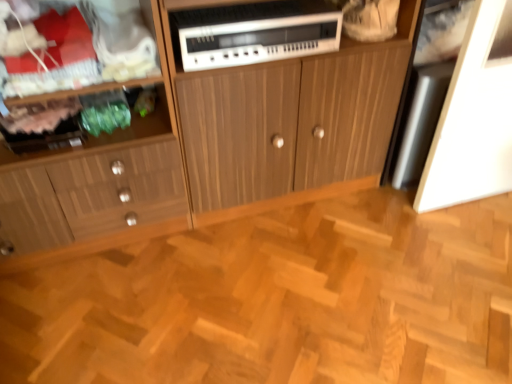
What do you see at coordinates (256, 33) in the screenshot? The height and width of the screenshot is (384, 512). I see `white plastic stereo at center` at bounding box center [256, 33].

I want to click on wooden cabinet at left, placed as the second cabinetry when sorted from right to left, so click(96, 185).

Image resolution: width=512 pixels, height=384 pixels. What do you see at coordinates (96, 185) in the screenshot?
I see `wooden cabinet at left, placed as the second cabinetry when sorted from right to left` at bounding box center [96, 185].

Locate an element on the screen. Image resolution: width=512 pixels, height=384 pixels. white plastic stereo at center is located at coordinates (256, 33).

Looking at their sizes, would you say natural wood parquet floor at center is wider or thinner than white plastic stereo at center?

natural wood parquet floor at center is wider than white plastic stereo at center.

Would you say white plastic stereo at center is part of natural wood parquet floor at center's contents?

No, white plastic stereo at center is located outside of natural wood parquet floor at center.

Considering the positions of point (313, 213) and point (217, 51), is point (313, 213) closer or farther from the camera than point (217, 51)?

Point (313, 213) appears to be farther away from the viewer than point (217, 51).

In the image, is natural wood parquet floor at center positioned in front of or behind white plastic stereo at center?

natural wood parquet floor at center is in front of white plastic stereo at center.

Between wooden cabinet at left, which appears as the first cabinetry when viewed from the left, and wooden cabinet at center, acting as the 1th cabinetry starting from the right, which one is positioned behind?

wooden cabinet at center, acting as the 1th cabinetry starting from the right.

Consider the image. Measure the distance between wooden cabinet at left, placed as the second cabinetry when sorted from right to left, and wooden cabinet at center, which appears as the second cabinetry when viewed from the left.

wooden cabinet at left, placed as the second cabinetry when sorted from right to left, and wooden cabinet at center, which appears as the second cabinetry when viewed from the left, are 15.88 inches apart from each other.

Which of these two, wooden cabinet at left, placed as the second cabinetry when sorted from right to left, or wooden cabinet at center, which appears as the second cabinetry when viewed from the left, is smaller?

Smaller between the two is wooden cabinet at left, placed as the second cabinetry when sorted from right to left.

From the image's perspective, who appears lower, wooden cabinet at left, placed as the second cabinetry when sorted from right to left, or wooden cabinet at center, which appears as the second cabinetry when viewed from the left?

wooden cabinet at left, placed as the second cabinetry when sorted from right to left.

Looking at this image, between wooden cabinet at center, acting as the 1th cabinetry starting from the right, and natural wood parquet floor at center, which one has larger width?

natural wood parquet floor at center is wider.

Is wooden cabinet at center, acting as the 1th cabinetry starting from the right, not near natural wood parquet floor at center?

wooden cabinet at center, acting as the 1th cabinetry starting from the right, is near natural wood parquet floor at center, not far away.

Measure the distance between wooden cabinet at center, acting as the 1th cabinetry starting from the right, and natural wood parquet floor at center.

They are 20.19 inches apart.

Is wooden cabinet at center, which appears as the second cabinetry when viewed from the left, inside or outside of natural wood parquet floor at center?

wooden cabinet at center, which appears as the second cabinetry when viewed from the left, cannot be found inside natural wood parquet floor at center.

Considering the relative positions of wooden cabinet at center, acting as the 1th cabinetry starting from the right, and wooden cabinet at left, which appears as the first cabinetry when viewed from the left, in the image provided, is wooden cabinet at center, acting as the 1th cabinetry starting from the right, behind wooden cabinet at left, which appears as the first cabinetry when viewed from the left,?

That is True.

Between wooden cabinet at center, acting as the 1th cabinetry starting from the right, and wooden cabinet at left, placed as the second cabinetry when sorted from right to left, which one has larger size?

wooden cabinet at center, acting as the 1th cabinetry starting from the right.

From the image's perspective, is wooden cabinet at center, which appears as the second cabinetry when viewed from the left, below wooden cabinet at left, which appears as the first cabinetry when viewed from the left?

Incorrect, from the image's perspective, wooden cabinet at center, which appears as the second cabinetry when viewed from the left, is higher than wooden cabinet at left, which appears as the first cabinetry when viewed from the left.

Which object is wider, wooden cabinet at center, acting as the 1th cabinetry starting from the right, or wooden cabinet at left, placed as the second cabinetry when sorted from right to left?

wooden cabinet at center, acting as the 1th cabinetry starting from the right.

Is white plastic stereo at center wider or thinner than wooden cabinet at center, which appears as the second cabinetry when viewed from the left?

Clearly, white plastic stereo at center has less width compared to wooden cabinet at center, which appears as the second cabinetry when viewed from the left.

Considering the relative sizes of white plastic stereo at center and wooden cabinet at center, acting as the 1th cabinetry starting from the right, in the image provided, is white plastic stereo at center smaller than wooden cabinet at center, acting as the 1th cabinetry starting from the right,?

Correct, white plastic stereo at center occupies less space than wooden cabinet at center, acting as the 1th cabinetry starting from the right.

Is white plastic stereo at center facing towards wooden cabinet at center, which appears as the second cabinetry when viewed from the left?

Yes, white plastic stereo at center is turned towards wooden cabinet at center, which appears as the second cabinetry when viewed from the left.

Is white plastic stereo at center further to camera compared to wooden cabinet at center, which appears as the second cabinetry when viewed from the left?

Yes, the depth of white plastic stereo at center is greater than that of wooden cabinet at center, which appears as the second cabinetry when viewed from the left.

The height and width of the screenshot is (384, 512). Find the location of `home appliance behind the wooden cabinet at left, which appears as the first cabinetry when viewed from the left`. home appliance behind the wooden cabinet at left, which appears as the first cabinetry when viewed from the left is located at coordinates (256, 33).

Does white plastic stereo at center have a larger size compared to wooden cabinet at left, placed as the second cabinetry when sorted from right to left?

No.

Considering the relative sizes of white plastic stereo at center and wooden cabinet at left, placed as the second cabinetry when sorted from right to left, in the image provided, is white plastic stereo at center taller than wooden cabinet at left, placed as the second cabinetry when sorted from right to left,?

No, white plastic stereo at center is not taller than wooden cabinet at left, placed as the second cabinetry when sorted from right to left.

Between white plastic stereo at center and wooden cabinet at left, which appears as the first cabinetry when viewed from the left, which one appears on the left side from the viewer's perspective?

wooden cabinet at left, which appears as the first cabinetry when viewed from the left.

Visually, is natural wood parquet floor at center positioned to the left or to the right of wooden cabinet at center, acting as the 1th cabinetry starting from the right?

Clearly, natural wood parquet floor at center is on the right of wooden cabinet at center, acting as the 1th cabinetry starting from the right, in the image.

From a real-world perspective, who is located higher, natural wood parquet floor at center or wooden cabinet at center, acting as the 1th cabinetry starting from the right?

wooden cabinet at center, acting as the 1th cabinetry starting from the right, is physically above.

Is point (282, 278) positioned in front of point (275, 191)?

Yes, it is.

Identify the location of hardwood located in front of the white plastic stereo at center. (278, 301).

Locate an element on the screen. Image resolution: width=512 pixels, height=384 pixels. cabinetry below the wooden cabinet at left, which appears as the first cabinetry when viewed from the left (from a real-world perspective) is located at coordinates (289, 124).

Which object lies further to the anchor point wooden cabinet at left, placed as the second cabinetry when sorted from right to left, wooden cabinet at center, which appears as the second cabinetry when viewed from the left, or white plastic stereo at center?

Among the two, white plastic stereo at center is located further to wooden cabinet at left, placed as the second cabinetry when sorted from right to left.

From the picture: Looking at the image, which one is located closer to natural wood parquet floor at center, wooden cabinet at center, acting as the 1th cabinetry starting from the right, or white plastic stereo at center?

wooden cabinet at center, acting as the 1th cabinetry starting from the right.

Considering their positions, is wooden cabinet at left, placed as the second cabinetry when sorted from right to left, positioned closer to wooden cabinet at center, acting as the 1th cabinetry starting from the right, than white plastic stereo at center?

white plastic stereo at center is positioned closer to the anchor wooden cabinet at center, acting as the 1th cabinetry starting from the right.

Which object lies further to the anchor point natural wood parquet floor at center, white plastic stereo at center or wooden cabinet at left, placed as the second cabinetry when sorted from right to left?

white plastic stereo at center is further to natural wood parquet floor at center.

From the picture: Estimate the real-world distances between objects in this image. Which object is closer to wooden cabinet at left, placed as the second cabinetry when sorted from right to left, natural wood parquet floor at center or white plastic stereo at center?

natural wood parquet floor at center.

Looking at the image, which one is located further to wooden cabinet at center, acting as the 1th cabinetry starting from the right, natural wood parquet floor at center or wooden cabinet at left, placed as the second cabinetry when sorted from right to left?

The object further to wooden cabinet at center, acting as the 1th cabinetry starting from the right, is natural wood parquet floor at center.

When comparing their distances from natural wood parquet floor at center, does wooden cabinet at left, which appears as the first cabinetry when viewed from the left, or white plastic stereo at center seem further?

Based on the image, white plastic stereo at center appears to be further to natural wood parquet floor at center.

Estimate the real-world distances between objects in this image. Which object is closer to natural wood parquet floor at center, wooden cabinet at left, placed as the second cabinetry when sorted from right to left, or wooden cabinet at center, acting as the 1th cabinetry starting from the right?

wooden cabinet at left, placed as the second cabinetry when sorted from right to left, lies closer to natural wood parquet floor at center than the other object.

At what (x,y) coordinates should I click in order to perform the action: click on home appliance between wooden cabinet at left, placed as the second cabinetry when sorted from right to left, and natural wood parquet floor at center from left to right. Please return your answer as a coordinate pair (x, y). This screenshot has height=384, width=512. Looking at the image, I should click on (256, 33).

You are a GUI agent. You are given a task and a screenshot of the screen. Output one action in this format:
    pyautogui.click(x=<x>, y=<y>)
    Task: Click on the cabinetry between wooden cabinet at left, placed as the second cabinetry when sorted from right to left, and natural wood parquet floor at center, in the horizontal direction
    Image resolution: width=512 pixels, height=384 pixels.
    Given the screenshot: What is the action you would take?
    pyautogui.click(x=289, y=124)

Identify the location of home appliance located between wooden cabinet at left, which appears as the first cabinetry when viewed from the left, and wooden cabinet at center, acting as the 1th cabinetry starting from the right, in the left-right direction. The image size is (512, 384). (256, 33).